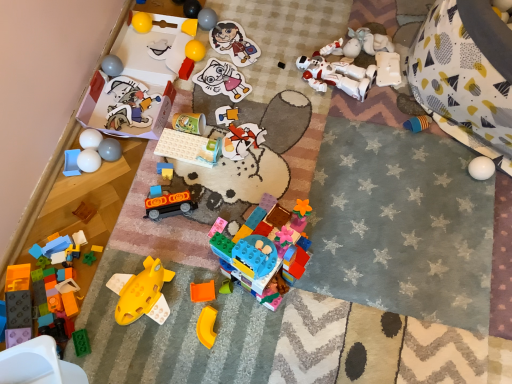
Locate an element on the screen. free space to the right of orange matte toy airplane at center, the 16th toy positioned from the left is located at coordinates (261, 314).